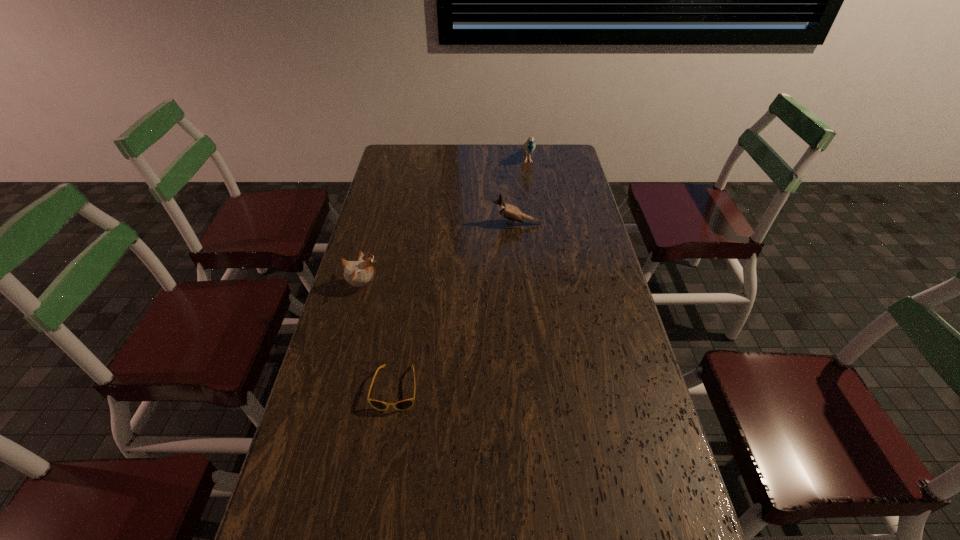
The width and height of the screenshot is (960, 540). Find the location of `vacant space in between the second farthest object and the farthest bird`. vacant space in between the second farthest object and the farthest bird is located at coordinates (523, 191).

What are the coordinates of `free space between the leftmost bird and the third nearest object` in the screenshot? It's located at (441, 255).

The width and height of the screenshot is (960, 540). Identify the location of vacant area between the leftmost bird and the farthest bird. (445, 222).

Image resolution: width=960 pixels, height=540 pixels. Find the location of `vacant area that lies between the nearest bird and the second object from left to right`. vacant area that lies between the nearest bird and the second object from left to right is located at coordinates (379, 337).

The height and width of the screenshot is (540, 960). What are the coordinates of `vacant space that is in between the nearest object and the second farthest bird` in the screenshot? It's located at (457, 306).

Find the location of a particular element. vacant space that's between the third object from right to left and the nearest bird is located at coordinates (379, 337).

Locate an element on the screen. Image resolution: width=960 pixels, height=540 pixels. free space between the third nearest object and the leftmost object is located at coordinates [x=441, y=255].

Identify the location of empty location between the farthest bird and the second farthest bird. This screenshot has width=960, height=540. (523, 191).

You are a GUI agent. You are given a task and a screenshot of the screen. Output one action in this format:
    pyautogui.click(x=<x>, y=<y>)
    Task: Click on the free point between the farthest bird and the third nearest object
    
    Given the screenshot: What is the action you would take?
    pyautogui.click(x=523, y=191)

Select which object is the closest to the farthest object. Please provide its 2D coordinates. Your answer should be formatted as a tuple, i.e. [(x, y)], where the tuple contains the x and y coordinates of a point satisfying the conditions above.

[(509, 212)]